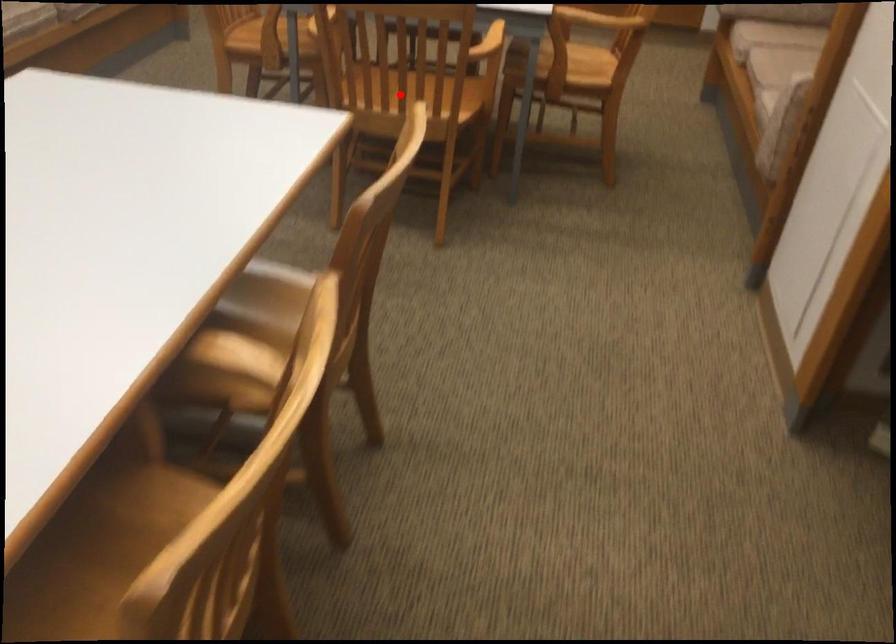
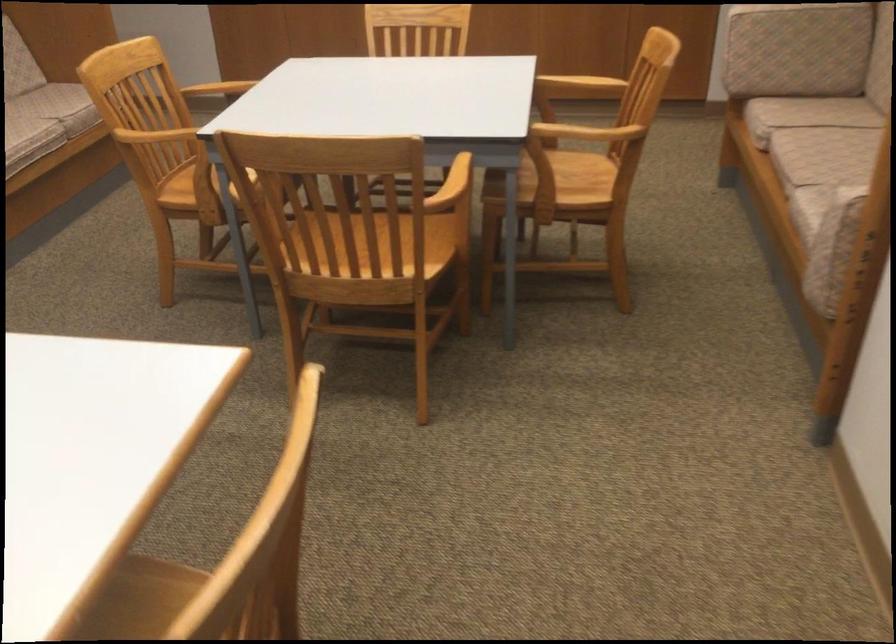
In the second image, find the point that corresponds to the highlighted location in the first image.

(358, 259)